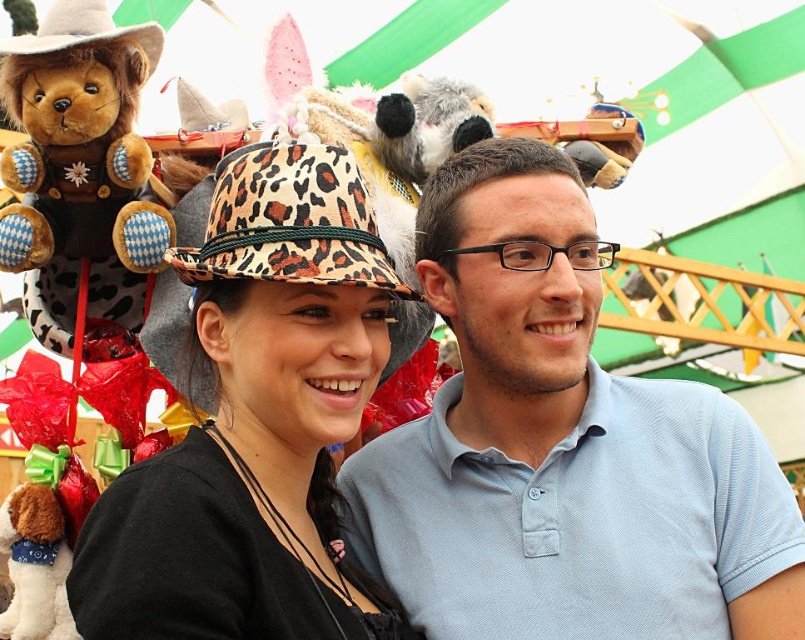
Is light blue cotton shirt at center behind brown plush bear at left?

Yes, it is.

The height and width of the screenshot is (640, 805). I want to click on light blue cotton shirt at center, so (x=562, y=449).

Between point (655, 429) and point (48, 204), which one is positioned in front?

Point (48, 204) is more forward.

Where is `light blue cotton shirt at center`? This screenshot has height=640, width=805. light blue cotton shirt at center is located at coordinates (562, 449).

Can you confirm if leopard print hat at center is shorter than leopard print fabric bucket hat at center?

In fact, leopard print hat at center may be taller than leopard print fabric bucket hat at center.

Is leopard print hat at center above leopard print fabric bucket hat at center?

Actually, leopard print hat at center is below leopard print fabric bucket hat at center.

Is point (292, 220) positioned in front of point (345, 224)?

Yes, point (292, 220) is in front of point (345, 224).

The height and width of the screenshot is (640, 805). I want to click on leopard print hat at center, so tap(256, 424).

Between light blue cotton shirt at center and leopard print fabric bucket hat at center, which one has more height?

With more height is light blue cotton shirt at center.

Who is shorter, light blue cotton shirt at center or leopard print fabric bucket hat at center?

leopard print fabric bucket hat at center

Which is in front, point (760, 442) or point (238, 161)?

Positioned in front is point (238, 161).

Image resolution: width=805 pixels, height=640 pixels. Identify the location of light blue cotton shirt at center. 562,449.